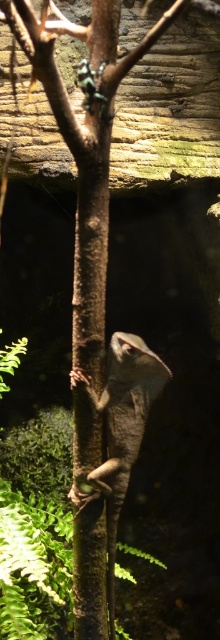
Question: Among these points, which one is nearest to the camera?

Choices:
 (A) (126, 461)
 (B) (99, 596)

Answer: (B)

Question: Which object appears closest to the camera in this image?

Choices:
 (A) brown textured lizard at center
 (B) brown rough tree trunk at center

Answer: (B)

Question: Does brown rough tree trunk at center have a smaller size compared to brown textured lizard at center?

Choices:
 (A) yes
 (B) no

Answer: (B)

Question: Does brown rough tree trunk at center have a lesser width compared to brown textured lizard at center?

Choices:
 (A) yes
 (B) no

Answer: (A)

Question: Is brown rough tree trunk at center above brown textured lizard at center?

Choices:
 (A) yes
 (B) no

Answer: (A)

Question: Which of the following is the farthest from the observer?

Choices:
 (A) brown textured lizard at center
 (B) brown rough tree trunk at center

Answer: (A)